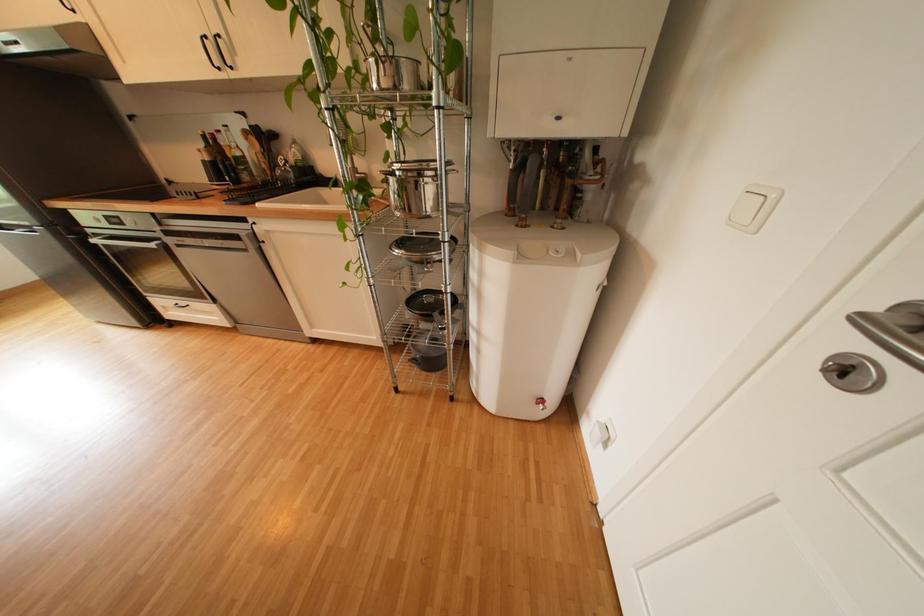
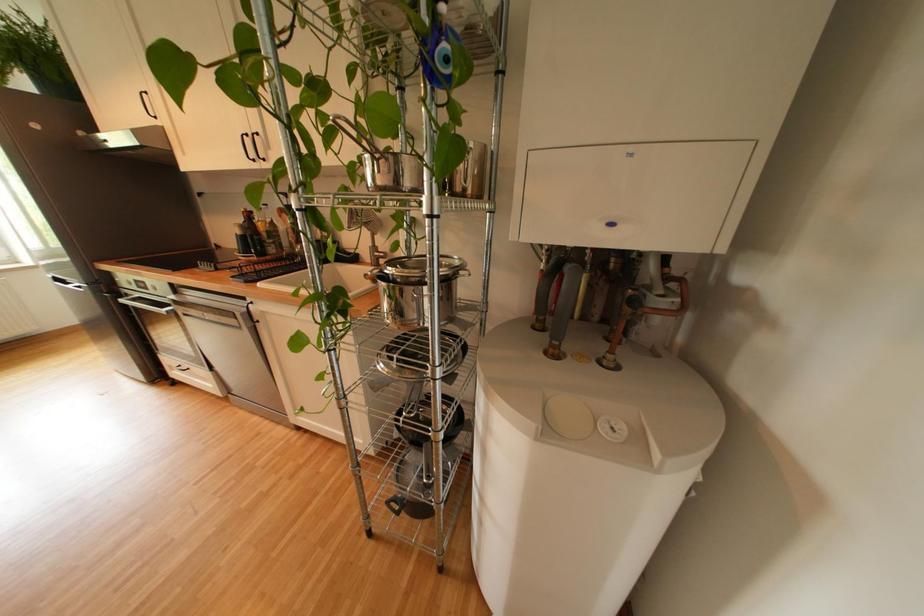
Question: The images are taken continuously from a first-person perspective. In which direction are you moving?

Choices:
 (A) Left
 (B) Right
 (C) Forward
 (D) Backward

Answer: (C)